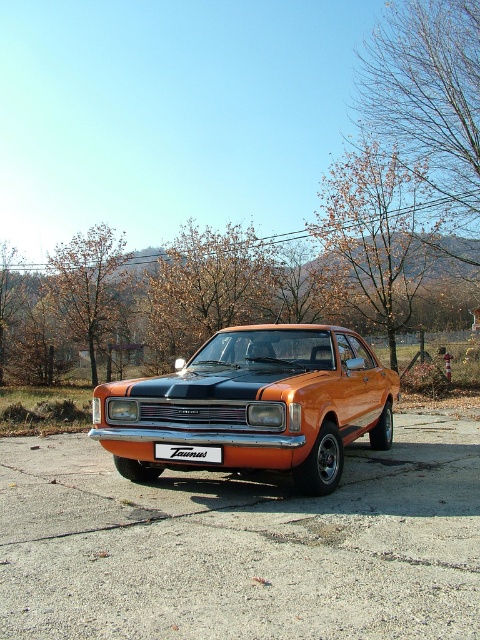
Question: Observing the image, what is the correct spatial positioning of orange metallic car at center in reference to white plastic sign at center?

Choices:
 (A) above
 (B) below

Answer: (A)

Question: Which of the following is the farthest from the observer?

Choices:
 (A) orange metallic car at center
 (B) white plastic sign at center

Answer: (B)

Question: Does orange metallic car at center lie in front of white plastic sign at center?

Choices:
 (A) no
 (B) yes

Answer: (B)

Question: Where is orange metallic car at center located in relation to white plastic sign at center in the image?

Choices:
 (A) below
 (B) above

Answer: (B)